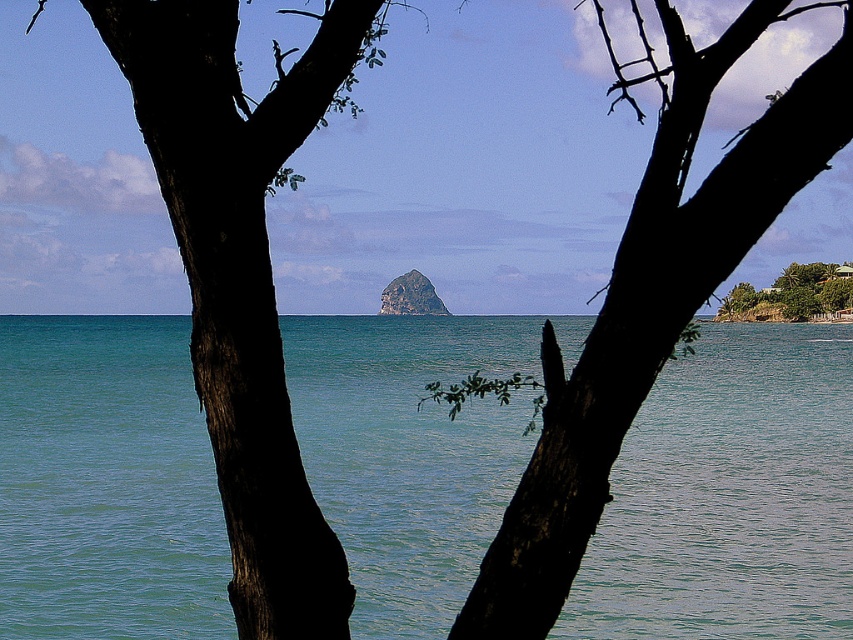
You are standing on the beach and looking at the clear blue water at center and the dark bark tree at center. Which object appears taller from your viewpoint?

The dark bark tree at center appears taller than the clear blue water at center because the clear blue water at center is shorter than dark bark tree at center according to the description.

You are standing on a path that goes from the left to the right side of the image. You see the clear blue water at center and the dark bark tree at center. Which object will you encounter first as you walk from left to right?

The clear blue water at center will be encountered first as you walk from left to right since it is positioned to the left of the dark bark tree at center.